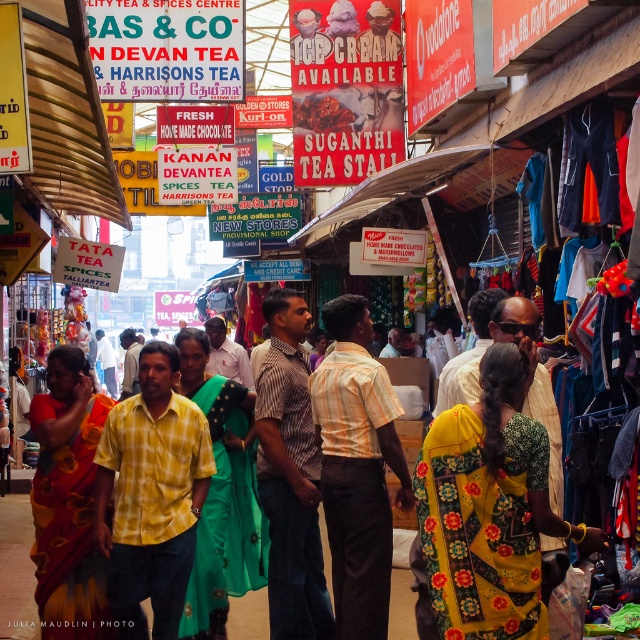
Which is above, yellow checkered shirt at center or yellow cotton saree at center?

Positioned higher is yellow checkered shirt at center.

Based on the photo, does yellow checkered shirt at center have a lesser width compared to yellow cotton saree at center?

Indeed, yellow checkered shirt at center has a lesser width compared to yellow cotton saree at center.

Locate an element on the screen. yellow checkered shirt at center is located at coordinates (150, 497).

Who is positioned more to the left, floral yellow sari at center or yellow striped shirt at center?

Positioned to the left is yellow striped shirt at center.

Does floral yellow sari at center have a larger size compared to yellow striped shirt at center?

Incorrect, floral yellow sari at center is not larger than yellow striped shirt at center.

Locate an element on the screen. Image resolution: width=640 pixels, height=640 pixels. floral yellow sari at center is located at coordinates (488, 513).

Which is below, floral yellow sari at center or yellow checkered shirt at center?

yellow checkered shirt at center

Does point (451, 550) come in front of point (170, 449)?

Yes.

Which is behind, point (476, 477) or point (161, 436)?

The point (161, 436) is more distant.

You are a GUI agent. You are given a task and a screenshot of the screen. Output one action in this format:
    pyautogui.click(x=<x>, y=<y>)
    Task: Click on the floral yellow sari at center
    
    Given the screenshot: What is the action you would take?
    pyautogui.click(x=488, y=513)